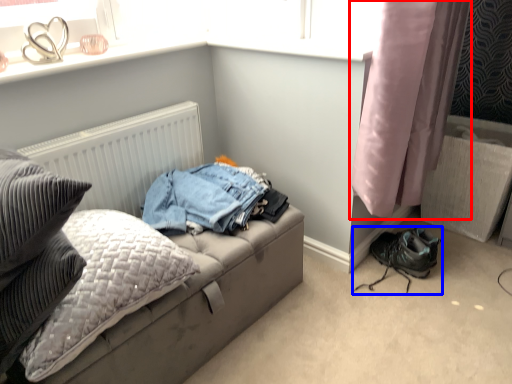
Question: Which point is closer to the camera, curtain (highlighted by a red box) or footwear (highlighted by a blue box)?

Choices:
 (A) curtain
 (B) footwear

Answer: (A)